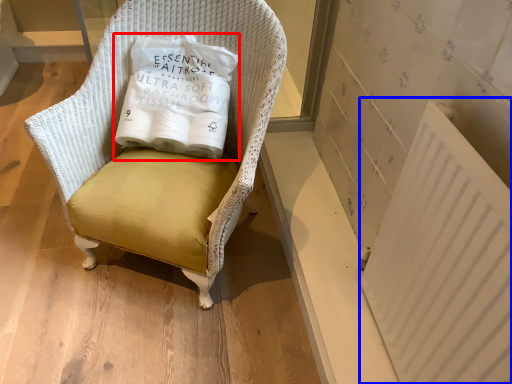
Question: Which object is further to the camera taking this photo, pillow (highlighted by a red box) or radiator (highlighted by a blue box)?

Choices:
 (A) pillow
 (B) radiator

Answer: (A)